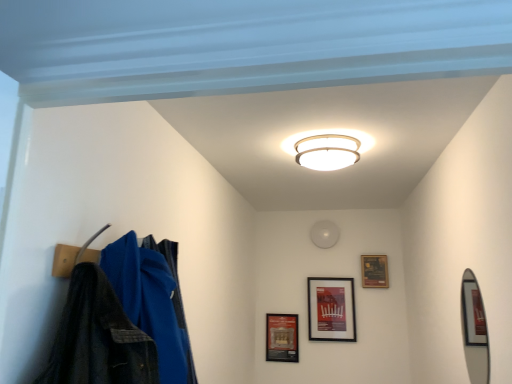
Question: Is point (327, 279) closer or farther from the camera than point (480, 344)?

Choices:
 (A) closer
 (B) farther

Answer: (B)

Question: Is black matte picture frame at upper center, positioned as the second picture frame in right-to-left order, spatially inside silver metallic mirror at right, or outside of it?

Choices:
 (A) inside
 (B) outside

Answer: (B)

Question: Which of these objects is positioned closest to the silver metallic mirror at right?

Choices:
 (A) matte brown picture frame at upper right, which ranks as the third picture frame in left-to-right order
 (B) matte black picture frame at lower center, the third picture frame in the right-to-left sequence
 (C) white glossy ceiling light at center
 (D) black matte picture frame at upper center, which ranks as the second picture frame in left-to-right order

Answer: (C)

Question: Which is nearer to the silver metallic mirror at right?

Choices:
 (A) white glossy ceiling light at center
 (B) matte brown picture frame at upper right, which ranks as the third picture frame in left-to-right order
 (C) black matte picture frame at upper center, positioned as the second picture frame in right-to-left order
 (D) matte black picture frame at lower center, which ranks as the first picture frame in left-to-right order

Answer: (A)